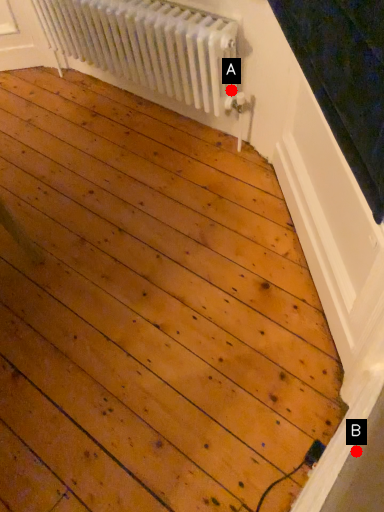
Question: Two points are circled on the image, labeled by A and B beside each circle. Which point appears closest to the camera in this image?

Choices:
 (A) A is closer
 (B) B is closer

Answer: (B)